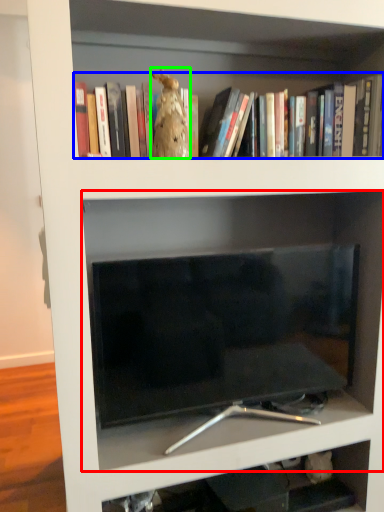
Question: Considering the real-world distances, which object is farthest from shelf (highlighted by a red box)? book (highlighted by a blue box) or animal (highlighted by a green box)?

Choices:
 (A) book
 (B) animal

Answer: (B)